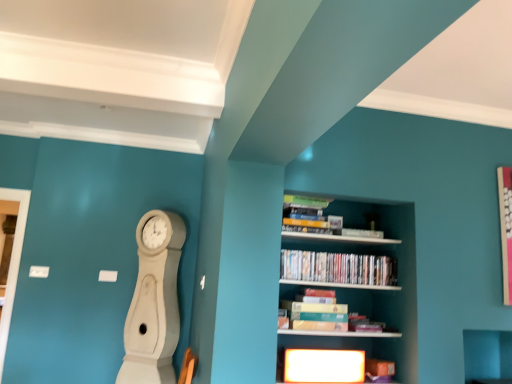
Question: Which direction should I rotate to face matte cardboard book at center, placed as the second book when sorted from top to bottom, — up or down?

Choices:
 (A) up
 (B) down

Answer: (B)

Question: Can you confirm if matte cardboard book at center, placed as the second book when sorted from top to bottom, is positioned to the left of white wood clock at left?

Choices:
 (A) yes
 (B) no

Answer: (B)

Question: Considering the relative sizes of matte cardboard book at center, placed as the second book when sorted from top to bottom, and white wood clock at left in the image provided, is matte cardboard book at center, placed as the second book when sorted from top to bottom, thinner than white wood clock at left?

Choices:
 (A) yes
 (B) no

Answer: (A)

Question: Can you confirm if matte cardboard book at center, which appears as the first book when ordered from the bottom, is shorter than white wood clock at left?

Choices:
 (A) no
 (B) yes

Answer: (B)

Question: Does matte cardboard book at center, placed as the second book when sorted from top to bottom, have a greater height compared to white wood clock at left?

Choices:
 (A) no
 (B) yes

Answer: (A)

Question: Is matte cardboard book at center, which appears as the first book when ordered from the bottom, touching white wood clock at left?

Choices:
 (A) yes
 (B) no

Answer: (B)

Question: Could you tell me if matte cardboard book at center, which appears as the first book when ordered from the bottom, is turned towards white wood clock at left?

Choices:
 (A) no
 (B) yes

Answer: (A)

Question: Is wooden bookshelf at center directly adjacent to matte cardboard book at center, which appears as the first book when ordered from the bottom?

Choices:
 (A) no
 (B) yes

Answer: (A)

Question: Does wooden bookshelf at center come in front of matte cardboard book at center, which appears as the first book when ordered from the bottom?

Choices:
 (A) yes
 (B) no

Answer: (A)

Question: From a real-world perspective, is wooden bookshelf at center below matte cardboard book at center, placed as the second book when sorted from top to bottom?

Choices:
 (A) no
 (B) yes

Answer: (A)

Question: Is wooden bookshelf at center at the right side of matte cardboard book at center, which appears as the first book when ordered from the bottom?

Choices:
 (A) no
 (B) yes

Answer: (B)

Question: Is wooden bookshelf at center turned away from matte cardboard book at center, placed as the second book when sorted from top to bottom?

Choices:
 (A) yes
 (B) no

Answer: (A)

Question: Does wooden bookshelf at center appear on the left side of matte cardboard book at center, placed as the second book when sorted from top to bottom?

Choices:
 (A) yes
 (B) no

Answer: (B)

Question: Considering the relative sizes of wooden bookshelf at center and matte plastic dvds at center, acting as the second book starting from the bottom, in the image provided, is wooden bookshelf at center smaller than matte plastic dvds at center, acting as the second book starting from the bottom,?

Choices:
 (A) no
 (B) yes

Answer: (A)